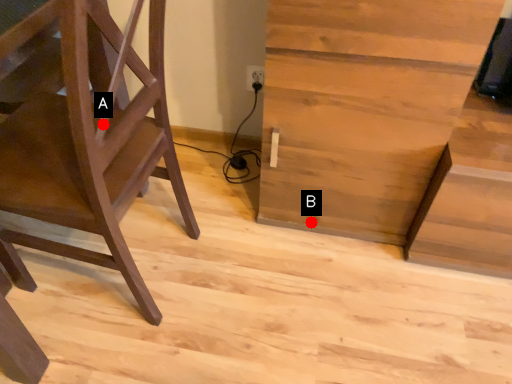
Question: Two points are circled on the image, labeled by A and B beside each circle. Which point appears farthest from the camera in this image?

Choices:
 (A) A is further
 (B) B is further

Answer: (B)